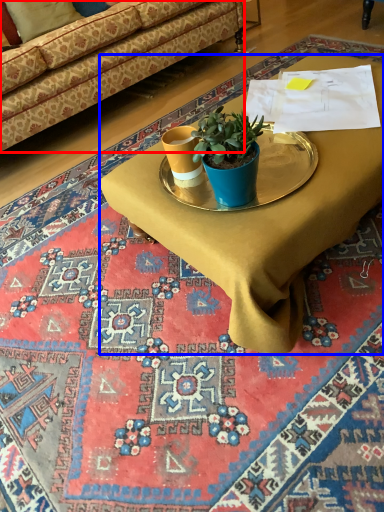
Question: Which object is closer to the camera taking this photo, studio couch (highlighted by a red box) or desk (highlighted by a blue box)?

Choices:
 (A) studio couch
 (B) desk

Answer: (B)